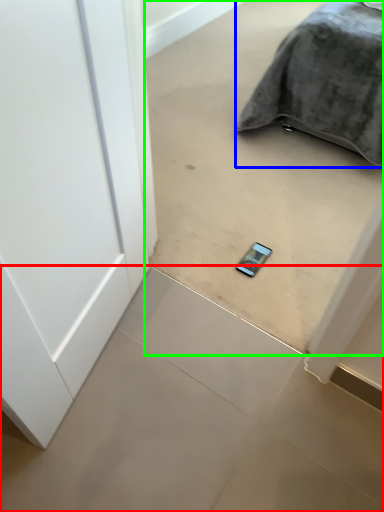
Question: Which object is positioned closest to concrete (highlighted by a red box)? Select from furniture (highlighted by a blue box) and concrete (highlighted by a green box).

Choices:
 (A) furniture
 (B) concrete

Answer: (B)